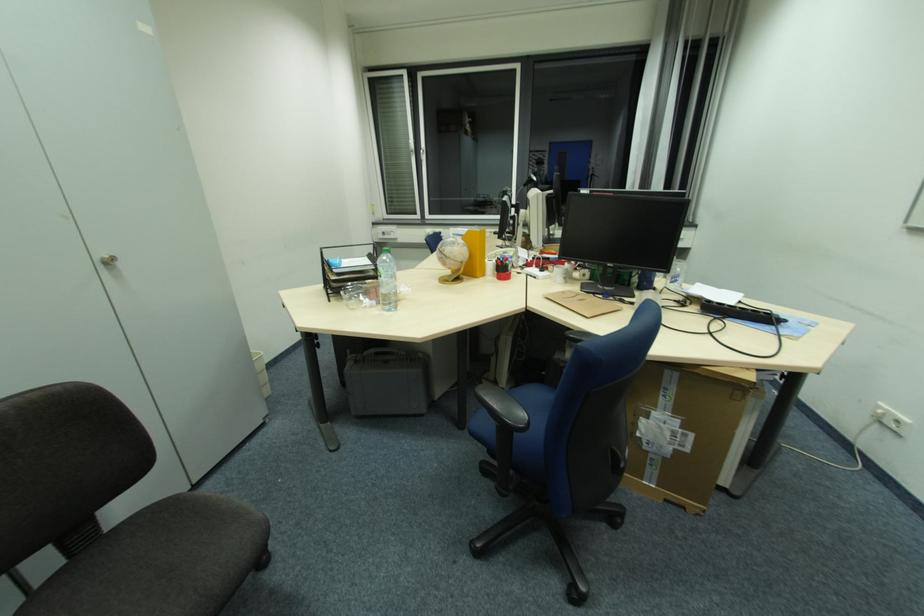
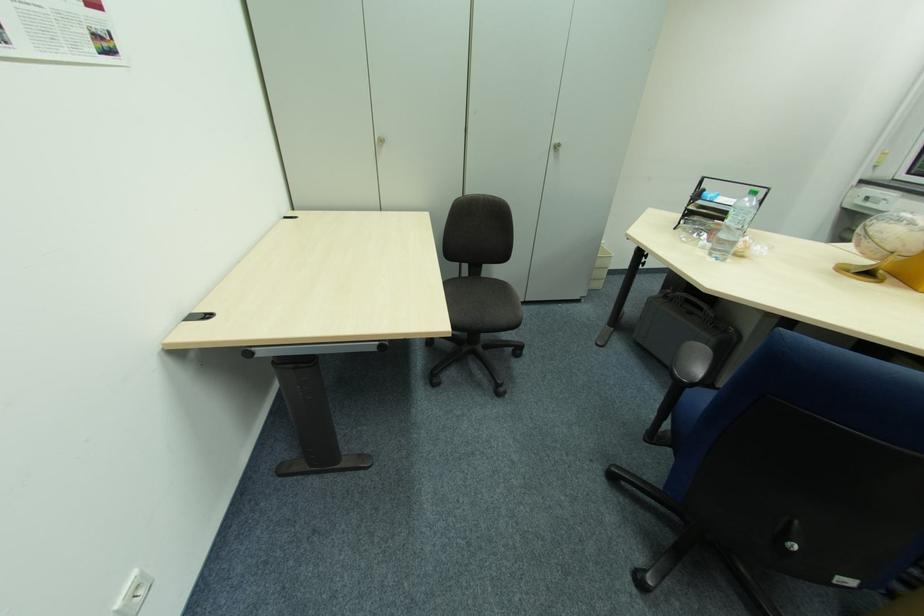
Where in the second image is the point corresponding to pixel 463 261 from the first image?

(893, 249)